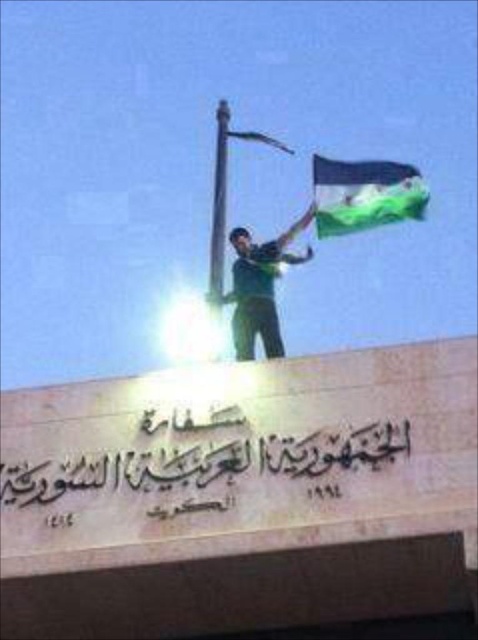
You are an observer looking at the scene. You notice the green fabric flag at upper right and the green matte shirt at center. Which object has a greater width?

The green fabric flag at upper right has a greater width than the green matte shirt at center.

You are a photographer trying to capture a clear photo of both the green fabric flag at upper right and the green matte shirt at center. Which object will appear closer to you in the photo?

The green fabric flag at upper right will appear closer to you in the photo because it is further to the viewer than the green matte shirt at center.

You are a photographer trying to capture the beige stone inscription at center and the green fabric flag at upper right in a single shot. Which object will appear larger in your photo?

The beige stone inscription at center will appear larger in the photo because it is closer to the viewer than the green fabric flag at upper right.